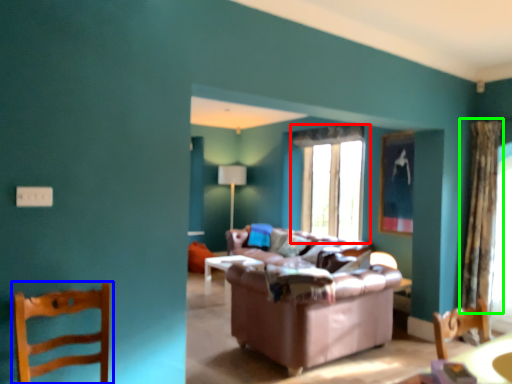
Question: Which object is the closest to the window (highlighted by a red box)? Choose among these: chair (highlighted by a blue box) or curtain (highlighted by a green box).

Choices:
 (A) chair
 (B) curtain

Answer: (B)